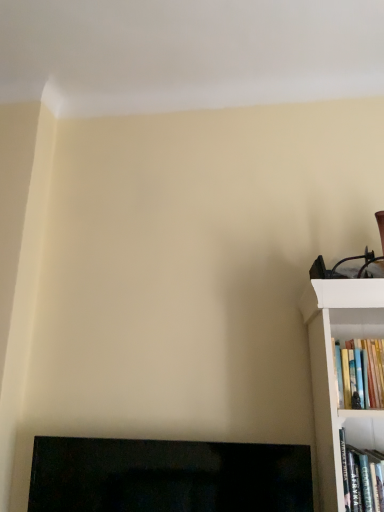
Question: Considering the positions of hardcover book at right, the 1th book when ordered from bottom to top, and black glossy fireplace at lower left in the image, is hardcover book at right, the 1th book when ordered from bottom to top, taller or shorter than black glossy fireplace at lower left?

Choices:
 (A) short
 (B) tall

Answer: (A)

Question: From a real-world perspective, relative to black glossy fireplace at lower left, is hardcover book at right, which ranks as the second book in top-to-bottom order, vertically above or below?

Choices:
 (A) above
 (B) below

Answer: (A)

Question: Which of these objects is positioned farthest from the black glossy fireplace at lower left?

Choices:
 (A) hardcover books at right, placed as the second book when sorted from bottom to top
 (B) hardcover book at right, the 1th book when ordered from bottom to top

Answer: (A)

Question: Estimate the real-world distances between objects in this image. Which object is farther from the hardcover book at right, the 1th book when ordered from bottom to top?

Choices:
 (A) black glossy fireplace at lower left
 (B) hardcover books at right, placed as the second book when sorted from bottom to top

Answer: (A)